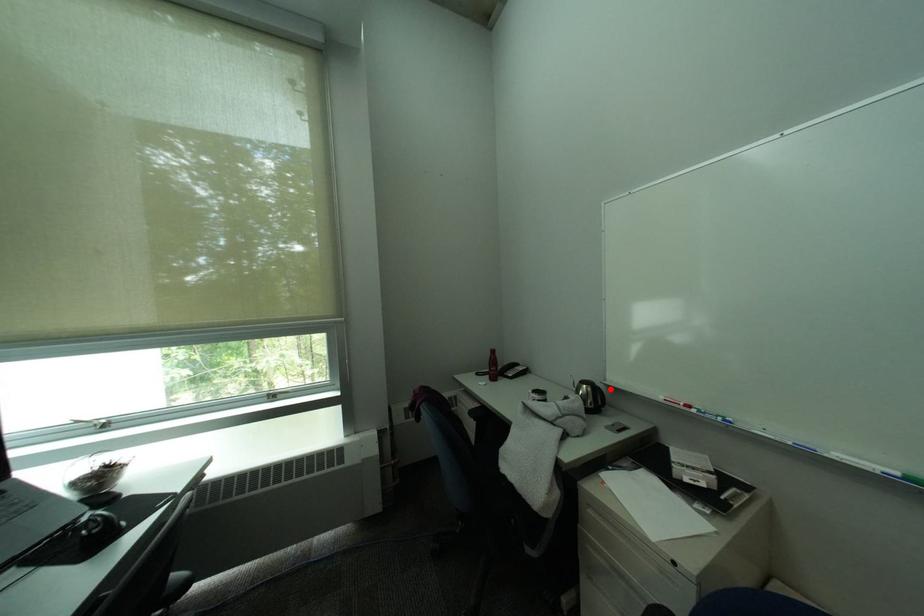
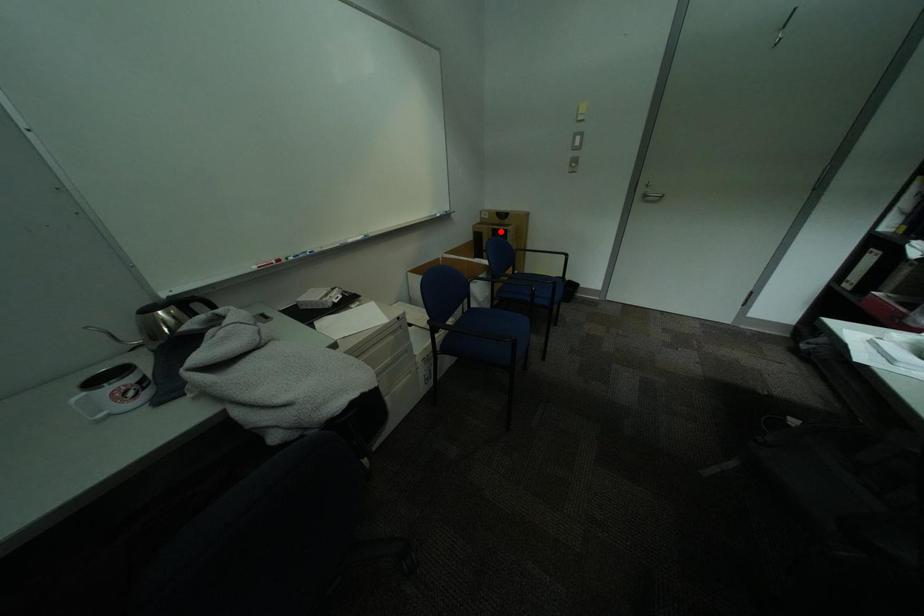
I am providing you with two images of the same scene from different viewpoints. A red point is marked on the first image and another point is marked on the second image. Is the red point in image1 aligned with the point shown in image2?

No